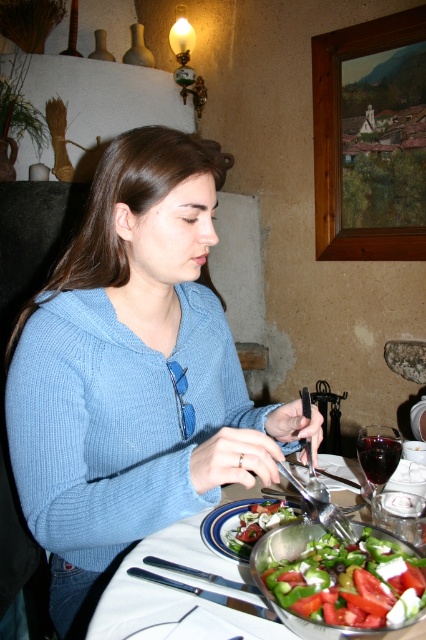
You are a photographer trying to capture the fresh green leafy salad at lower right and the wooden picture frame at upper right in the same shot. Which object will appear larger in your photo?

The fresh green leafy salad at lower right will appear larger in the photo because it is closer to the viewer than the wooden picture frame at upper right.

You are a waiter in a restaurant and you see the fresh green leafy salad at lower right and the green leafy salad at center. Which one is taller?

The fresh green leafy salad at lower right is much taller than the green leafy salad at center.